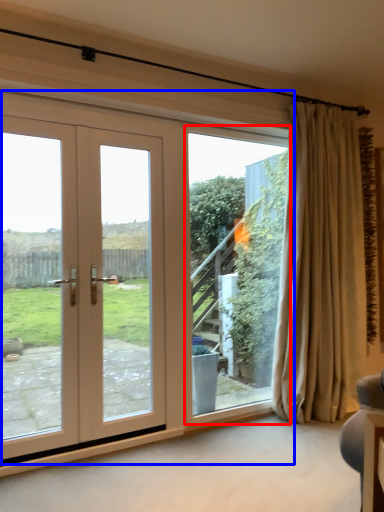
Question: Among these objects, which one is farthest to the camera, window screen (highlighted by a red box) or door (highlighted by a blue box)?

Choices:
 (A) window screen
 (B) door

Answer: (A)